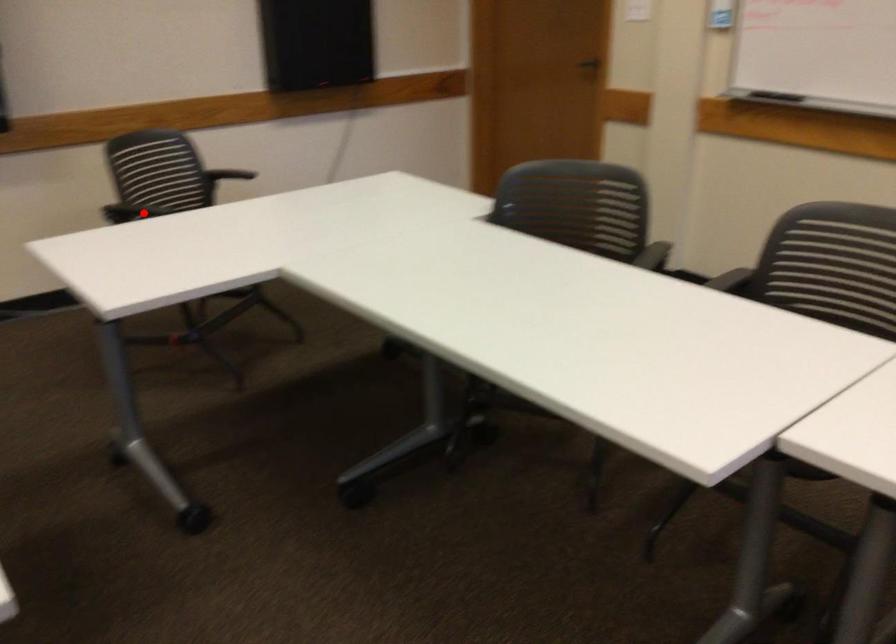
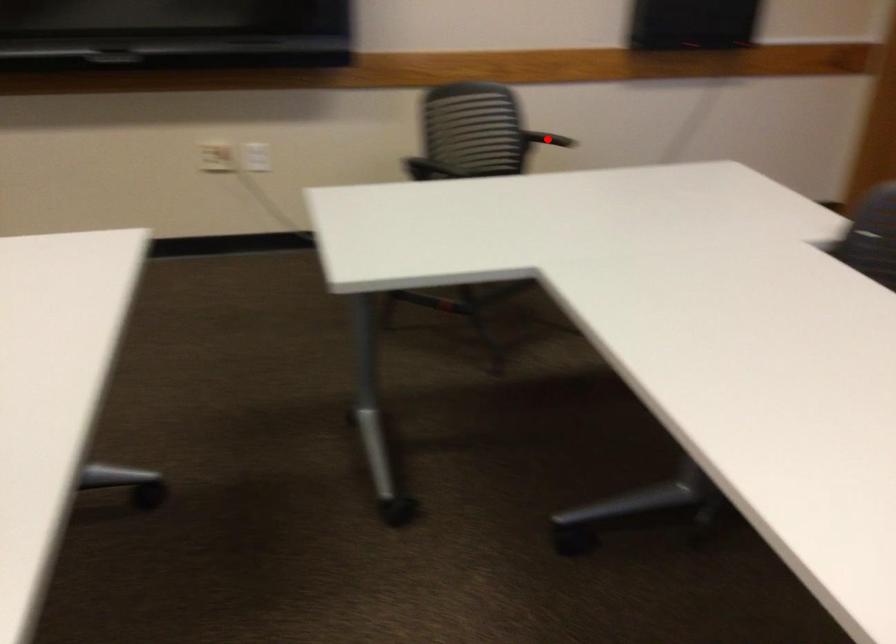
I am providing you with two images of the same scene from different viewpoints. A red point is marked on the first image and another point is marked on the second image. Do the highlighted points in image1 and image2 indicate the same real-world spot?

No